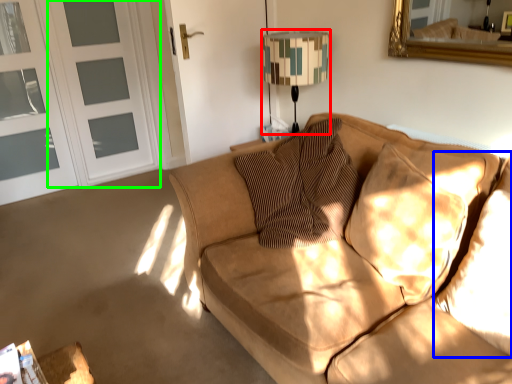
Question: Estimate the real-world distances between objects in this image. Which object is farther from table lamp (highlighted by a red box), pillow (highlighted by a blue box) or screen door (highlighted by a green box)?

Choices:
 (A) pillow
 (B) screen door

Answer: (B)